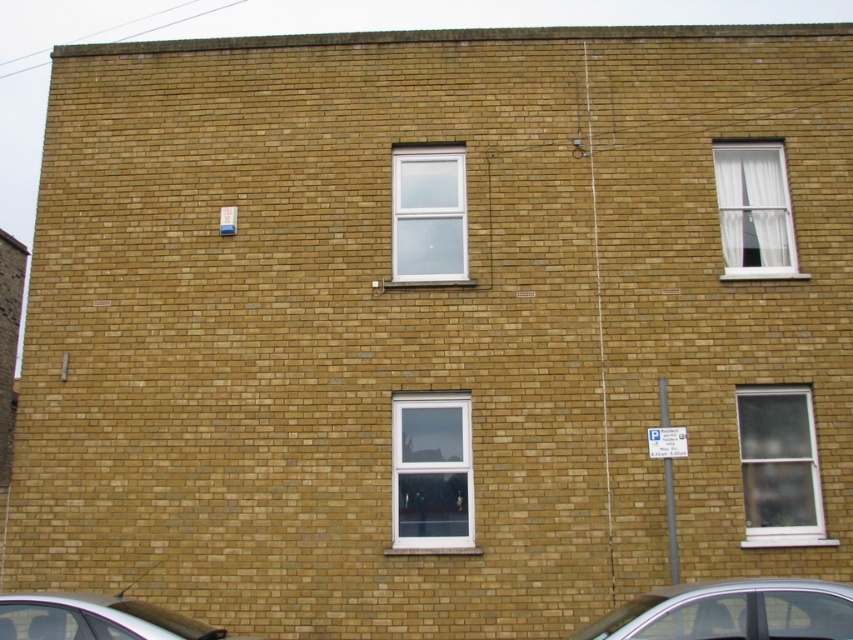
You are a delivery person trying to determine which window is closer to you. You see the white plastic window at center and the white matte window at upper right. Which one is closer to your current position?

The white plastic window at center is closer to you because it is in front of the white matte window at upper right.

You are standing in front of the two story brick building. You see two points marked on the wall. The first point is at coordinate point (769,636) and the second point is at coordinate point (457,179). Which point is closer to you?

Point (769,636) is closer to the viewer than point (457,179).